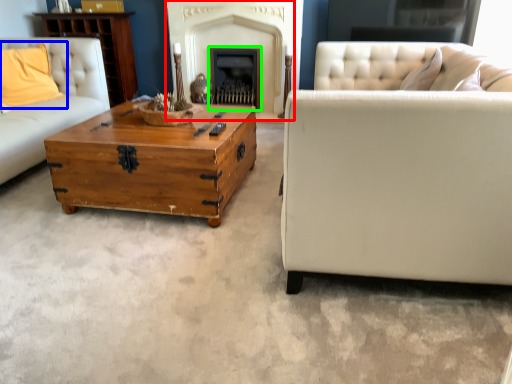
Question: Which object is the farthest from fireplace (highlighted by a red box)? Choose among these: pillow (highlighted by a blue box) or fireplace (highlighted by a green box).

Choices:
 (A) pillow
 (B) fireplace

Answer: (A)